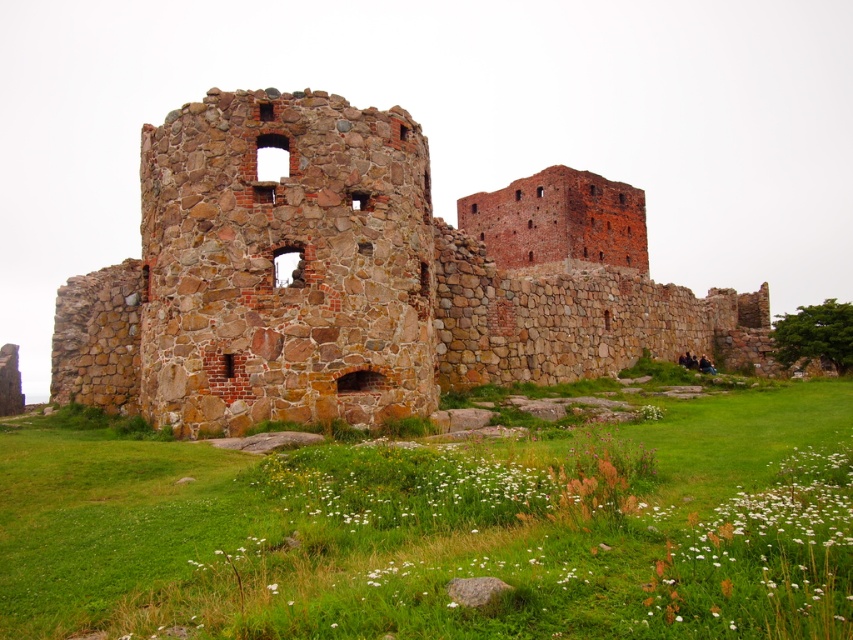
Does point (508, 593) lie behind point (637, 321)?

No, (508, 593) is in front of (637, 321).

Between green grassy at center and brown stone castle at center, which one has less height?

Standing shorter between the two is green grassy at center.

What do you see at coordinates (440, 531) in the screenshot? I see `green grassy at center` at bounding box center [440, 531].

At what (x,y) coordinates should I click in order to perform the action: click on green grassy at center. Please return your answer as a coordinate pair (x, y). This screenshot has width=853, height=640. Looking at the image, I should click on (440, 531).